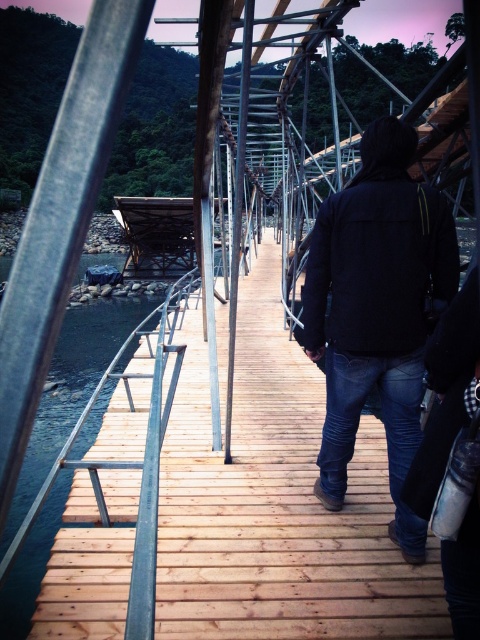
You are standing on the wooden suspension bridge and looking at two points on the bridge. The first point is at coordinate point [363,173] and the second is at point [121,353]. Which point is closer to you?

Point [363,173] is closer to the camera than point [121,353], so the first point is closer to you.

You are standing on the wooden suspension bridge and notice two objects in the scene. Which object is positioned lower in the image, the dark blue jeans at center or the brown wooden river at left?

The dark blue jeans at center is located below the brown wooden river at left, so the dark blue jeans at center is positioned lower in the image.

You are standing on the wooden suspension bridge at dusk and notice the dark blue jeans at center. Based on their position, can you determine if they are closer to the left or right side of the bridge?

The dark blue jeans at center are located at point coordinates that place them near the middle of the bridge, so they are neither closer to the left nor the right side.